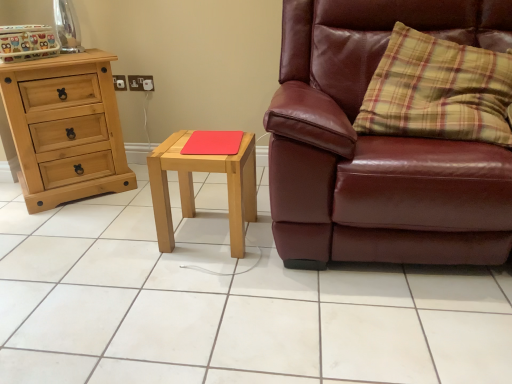
Image resolution: width=512 pixels, height=384 pixels. I want to click on blank space above light wood/matte nightstand at center (from a real-world perspective), so click(x=204, y=142).